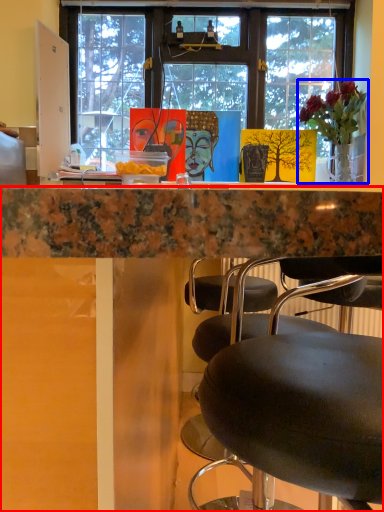
Question: Among these objects, which one is farthest to the camera, desk (highlighted by a red box) or houseplant (highlighted by a blue box)?

Choices:
 (A) desk
 (B) houseplant

Answer: (B)